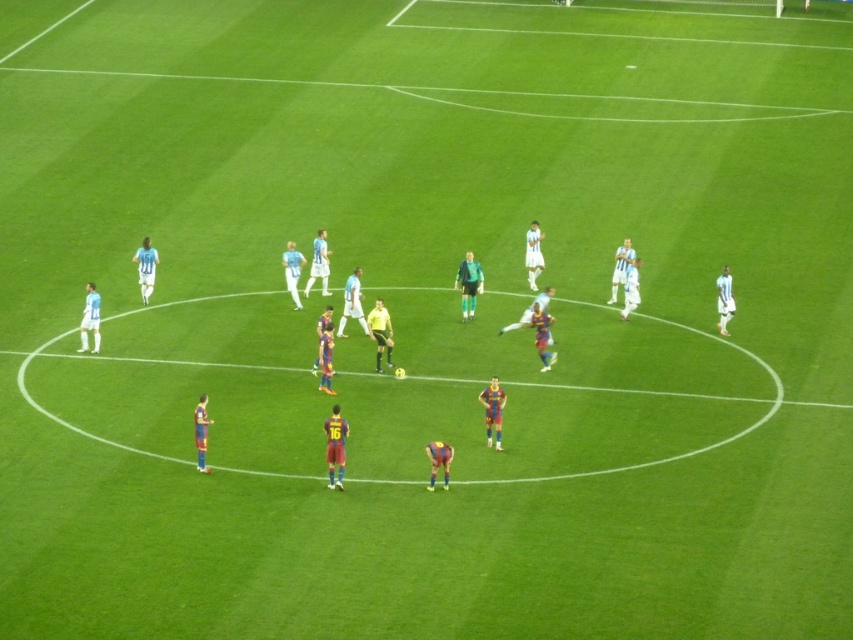
In the scene shown: You are a soccer referee observing the match. You notice two players, one wearing a maroon jersey at center and another in a white jersey at center. Which player is closer to the ground?

The maroon jersey at center is positioned under the white jersey at center, so the player in the maroon jersey at center is closer to the ground.

You are a soccer referee observing the match. You notice two players, one wearing a maroon jersey at center and another in a green jersey at center. Based on their positions, which player is closer to the ground?

The maroon jersey at center is below green jersey at center, so the player in the maroon jersey at center is closer to the ground.

You are a soccer referee observing the field. You notice the green jersey at center and the blue jersey at left. Which player is taller?

The green jersey at center is taller than the blue jersey at left.